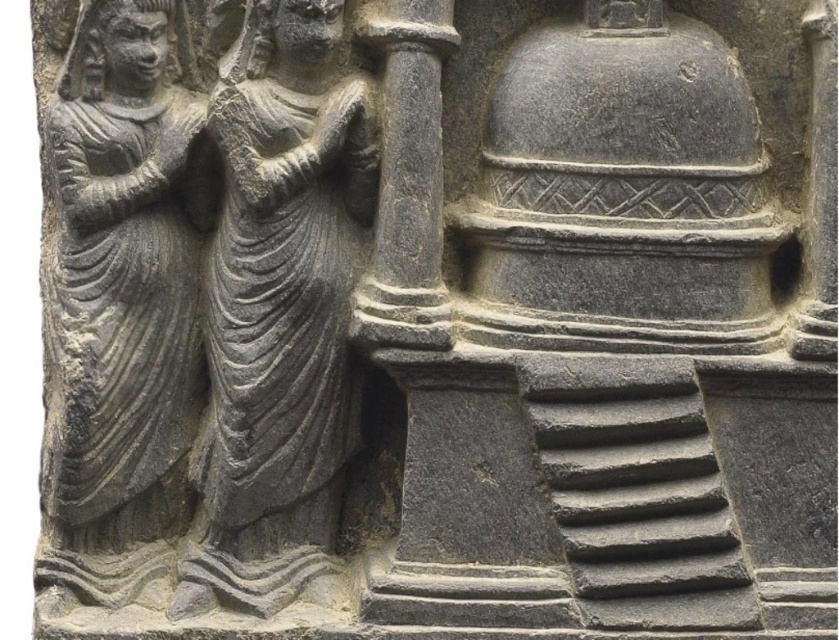
Based on the photo, based on the ancient stone relief sculpture scene, which object has a greater width between the gray stone statue at left and the gray stone pillar at center?

The gray stone statue at left has a greater width than the gray stone pillar at center according to the description.

You are an archaeologist examining the ancient stone relief sculpture. You notice two points marked on the relief. The first point is at coordinate (310, 442) and the second is at (121, 195). Which of these points is closer to you as you view the sculpture?

Point (310, 442) is further to the viewer than point (121, 195), so the point closer to you is point (121, 195).

What is the exact position of the gray stone statue at center in the image?

The gray stone statue at center is located at point (280, 276).